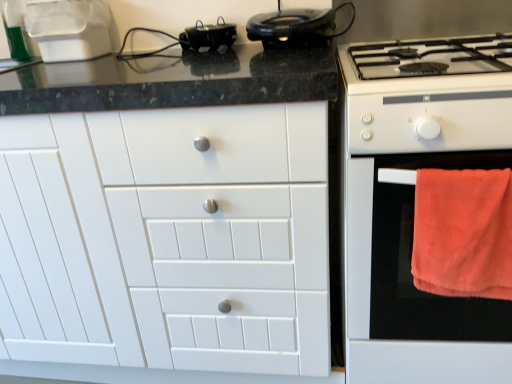
The width and height of the screenshot is (512, 384). Describe the element at coordinates (168, 239) in the screenshot. I see `white matte cabinet at center` at that location.

What are the coordinates of `orange soft towel at right` in the screenshot? It's located at (463, 233).

What do you see at coordinates (463, 233) in the screenshot? I see `orange soft towel at right` at bounding box center [463, 233].

What do you see at coordinates (413, 204) in the screenshot? The width and height of the screenshot is (512, 384). I see `orange towel at right` at bounding box center [413, 204].

The height and width of the screenshot is (384, 512). Identify the location of white glossy gas stove at right. click(x=429, y=94).

From the image's perspective, which is below, black glossy pot at upper center or orange soft towel at right?

orange soft towel at right.

Between black glossy pot at upper center and orange soft towel at right, which one is positioned in front?

orange soft towel at right is in front.

Are black glossy pot at upper center and orange soft towel at right far apart?

No.

Is orange towel at right outside of orange soft towel at right?

Yes, orange towel at right is not within orange soft towel at right.

Between orange towel at right and orange soft towel at right, which one has larger size?

orange towel at right.

Is orange towel at right turned away from orange soft towel at right?

No, orange soft towel at right is not at the back of orange towel at right.

Does white matte cabinet at center have a lesser height compared to orange soft towel at right?

Incorrect, the height of white matte cabinet at center does not fall short of that of orange soft towel at right.

What's the angular difference between white matte cabinet at center and orange soft towel at right's facing directions?

white matte cabinet at center and orange soft towel at right are facing 0.00671 degrees away from each other.

Considering the relative positions of white matte cabinet at center and orange soft towel at right in the image provided, is white matte cabinet at center to the right of orange soft towel at right from the viewer's perspective?

Incorrect, white matte cabinet at center is not on the right side of orange soft towel at right.

Is white matte cabinet at center not close to orange soft towel at right?

No, white matte cabinet at center is not far from orange soft towel at right.

Are white matte cabinet at center and orange towel at right located far from each other?

Actually, white matte cabinet at center and orange towel at right are a little close together.

Which is more to the left, white matte cabinet at center or orange towel at right?

Positioned to the left is white matte cabinet at center.

Looking at this image, would you say orange towel at right is part of white matte cabinet at center's contents?

Actually, orange towel at right is outside white matte cabinet at center.

Is white matte cabinet at center positioned with its back to orange towel at right?

No, orange towel at right is not at the back of white matte cabinet at center.

Considering the positions of point (498, 87) and point (139, 148), is point (498, 87) closer or farther from the camera than point (139, 148)?

Point (498, 87).

Does white glossy gas stove at right have a greater width compared to white matte cabinet at center?

Correct, the width of white glossy gas stove at right exceeds that of white matte cabinet at center.

Is white glossy gas stove at right positioned behind white matte cabinet at center?

No, white glossy gas stove at right is closer to the camera.

Is white glossy gas stove at right shorter than white matte cabinet at center?

Correct, white glossy gas stove at right is not as tall as white matte cabinet at center.

Is white glossy gas stove at right oriented towards black glossy pot at upper center?

No, white glossy gas stove at right does not turn towards black glossy pot at upper center.

Does white glossy gas stove at right have a larger size compared to black glossy pot at upper center?

Correct, white glossy gas stove at right is larger in size than black glossy pot at upper center.

From a real-world perspective, is white glossy gas stove at right physically above black glossy pot at upper center?

No, from a real-world perspective, white glossy gas stove at right is not above black glossy pot at upper center.

Is white glossy gas stove at right spatially inside black glossy pot at upper center, or outside of it?

white glossy gas stove at right lies outside black glossy pot at upper center.

Between white glossy gas stove at right and shiny black steering wheel at upper center, which one has smaller width?

shiny black steering wheel at upper center is thinner.

Based on the photo, is white glossy gas stove at right completely or partially outside of shiny black steering wheel at upper center?

Yes, white glossy gas stove at right is outside of shiny black steering wheel at upper center.

Considering the positions of points (415, 130) and (319, 18), is point (415, 130) closer to camera compared to point (319, 18)?

That is True.

Which object is positioned more to the left, white glossy gas stove at right or shiny black steering wheel at upper center?

From the viewer's perspective, shiny black steering wheel at upper center appears more on the left side.

The width and height of the screenshot is (512, 384). In the image, there is a black glossy pot at upper center. In order to click on beach towel below it (from a real-world perspective) in this screenshot , I will do `click(463, 233)`.

Where is `beach towel in front of the orange towel at right`? beach towel in front of the orange towel at right is located at coordinates (463, 233).

Consider the image. Which object lies nearer to the anchor point black glossy pot at upper center, white matte cabinet at center or white glossy gas stove at right?

Based on the image, white glossy gas stove at right appears to be nearer to black glossy pot at upper center.

In the scene shown: Considering their positions, is orange towel at right positioned further to white glossy gas stove at right than shiny black steering wheel at upper center?

shiny black steering wheel at upper center.

When comparing their distances from orange soft towel at right, does black glossy pot at upper center or white matte cabinet at center seem closer?

white matte cabinet at center lies closer to orange soft towel at right than the other object.

From the image, which object appears to be nearer to orange towel at right, white glossy gas stove at right or black glossy pot at upper center?

white glossy gas stove at right.

Estimate the real-world distances between objects in this image. Which object is closer to black glossy pot at upper center, white matte cabinet at center or orange towel at right?

white matte cabinet at center.

From the image, which object appears to be nearer to shiny black steering wheel at upper center, white glossy gas stove at right or orange towel at right?

white glossy gas stove at right.

Looking at the image, which one is located further to orange soft towel at right, shiny black steering wheel at upper center or orange towel at right?

shiny black steering wheel at upper center is positioned further to the anchor orange soft towel at right.

When comparing their distances from black glossy pot at upper center, does orange soft towel at right or white glossy gas stove at right seem closer?

Among the two, white glossy gas stove at right is located nearer to black glossy pot at upper center.

Find the location of a particular element. beach towel between black glossy pot at upper center and orange towel at right from left to right is located at coordinates (x=463, y=233).

Identify the location of gas stove between white matte cabinet at center and orange towel at right. The image size is (512, 384). (429, 94).

Where is `appliance between white matte cabinet at center and orange towel at right in the horizontal direction`? The image size is (512, 384). appliance between white matte cabinet at center and orange towel at right in the horizontal direction is located at coordinates (208, 35).

You are a GUI agent. You are given a task and a screenshot of the screen. Output one action in this format:
    pyautogui.click(x=<x>, y=<y>)
    Task: Click on the kitchen appliance between white matte cabinet at center and orange soft towel at right from left to right
    This screenshot has height=384, width=512.
    Given the screenshot: What is the action you would take?
    pyautogui.click(x=293, y=27)